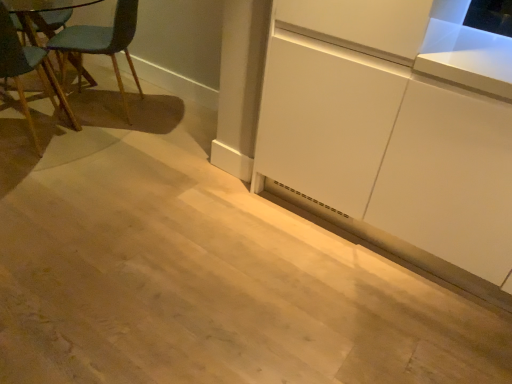
You are a GUI agent. You are given a task and a screenshot of the screen. Output one action in this format:
    pyautogui.click(x=<x>, y=<y>)
    Task: Click on the free space on the front side of white matte cabinet at lower right
    This screenshot has height=384, width=512.
    Given the screenshot: What is the action you would take?
    pyautogui.click(x=314, y=273)